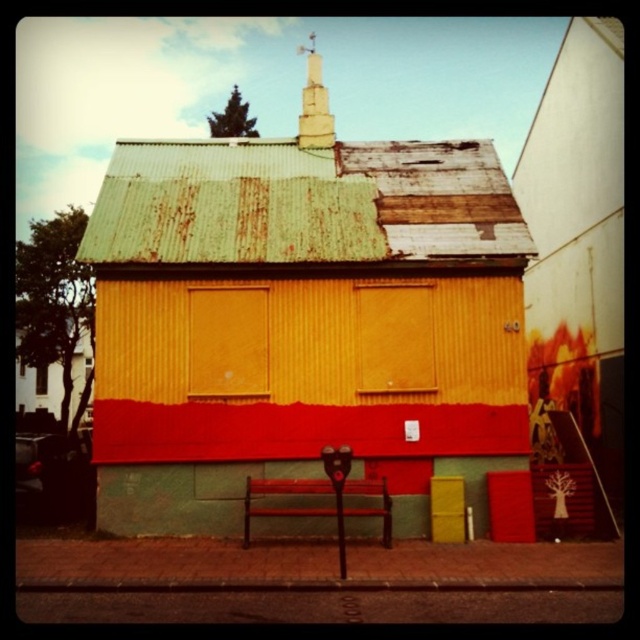
How distant is rusty corrugated metal church at center from smooth white spire at upper center?

The distance of rusty corrugated metal church at center from smooth white spire at upper center is 17.53 feet.

Is rusty corrugated metal church at center closer to camera compared to smooth white spire at upper center?

Yes, it is in front of smooth white spire at upper center.

This screenshot has height=640, width=640. What are the coordinates of `rusty corrugated metal church at center` in the screenshot? It's located at (301, 323).